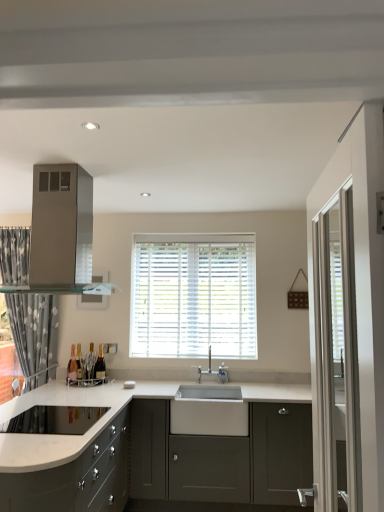
Describe the element at coordinates (209, 408) in the screenshot. I see `white matte sink at center` at that location.

Where is `matte gray cabinets at lower left, which is the 1th cabinetry in left-to-right order`? The height and width of the screenshot is (512, 384). matte gray cabinets at lower left, which is the 1th cabinetry in left-to-right order is located at coordinates (77, 478).

Measure the distance between point (236, 350) and camera.

They are 3.80 meters apart.

The image size is (384, 512). In order to click on satin silver range hood at upper left in this screenshot , I will do `click(61, 225)`.

Is shiny dark glass wine bottle at lower left, marked as the first wine bottle in a right-to-left arrangement, positioned far away from satin silver range hood at upper left?

Yes, shiny dark glass wine bottle at lower left, marked as the first wine bottle in a right-to-left arrangement, is far from satin silver range hood at upper left.

What are the coordinates of `appliance that appears on the left of shiny dark glass wine bottle at lower left, marked as the first wine bottle in a right-to-left arrangement` in the screenshot? It's located at (61, 225).

Is shiny dark glass wine bottle at lower left, marked as the first wine bottle in a right-to-left arrangement, positioned before satin silver range hood at upper left?

No, shiny dark glass wine bottle at lower left, marked as the first wine bottle in a right-to-left arrangement, is behind satin silver range hood at upper left.

What's the angular difference between shiny dark glass wine bottle at lower left, arranged as the second wine bottle when viewed from the left, and satin silver range hood at upper left's facing directions?

The angular difference between shiny dark glass wine bottle at lower left, arranged as the second wine bottle when viewed from the left, and satin silver range hood at upper left is 89.6 degrees.

Between white matte sink at center and matte gray cabinet at center, arranged as the second cabinetry when viewed from the left, which one has smaller size?

Smaller between the two is white matte sink at center.

Is white matte sink at center completely or partially outside of matte gray cabinet at center, arranged as the second cabinetry when viewed from the left?

No, white matte sink at center is inside matte gray cabinet at center, arranged as the second cabinetry when viewed from the left,'s boundary.

Which of these two, white matte sink at center or matte gray cabinet at center, positioned as the 1th cabinetry in right-to-left order, stands shorter?

white matte sink at center.

Considering the sizes of objects white matte sink at center and matte gray cabinet at center, arranged as the second cabinetry when viewed from the left, in the image provided, who is thinner, white matte sink at center or matte gray cabinet at center, arranged as the second cabinetry when viewed from the left,?

With smaller width is white matte sink at center.

Who is more distant, silver metallic faucet at center or white matte sink at center?

silver metallic faucet at center is more distant.

Which object is positioned more to the left, silver metallic faucet at center or white matte sink at center?

white matte sink at center.

What's the angular difference between silver metallic faucet at center and white matte sink at center's facing directions?

There is a 7.64e-05-degree angle between the facing directions of silver metallic faucet at center and white matte sink at center.

From the picture: Which of these two, silver metallic faucet at center or white matte sink at center, is wider?

white matte sink at center is wider.

How many degrees apart are the facing directions of matte gray cabinet at center, positioned as the 1th cabinetry in right-to-left order, and shiny dark glass wine bottle at lower left, marked as the first wine bottle in a right-to-left arrangement?

The angular difference between matte gray cabinet at center, positioned as the 1th cabinetry in right-to-left order, and shiny dark glass wine bottle at lower left, marked as the first wine bottle in a right-to-left arrangement, is 1.08 degrees.

Considering the positions of objects matte gray cabinet at center, positioned as the 1th cabinetry in right-to-left order, and shiny dark glass wine bottle at lower left, marked as the first wine bottle in a right-to-left arrangement, in the image provided, who is more to the right, matte gray cabinet at center, positioned as the 1th cabinetry in right-to-left order, or shiny dark glass wine bottle at lower left, marked as the first wine bottle in a right-to-left arrangement,?

matte gray cabinet at center, positioned as the 1th cabinetry in right-to-left order, is more to the right.

Is matte gray cabinet at center, positioned as the 1th cabinetry in right-to-left order, taller or shorter than shiny dark glass wine bottle at lower left, marked as the first wine bottle in a right-to-left arrangement?

In the image, matte gray cabinet at center, positioned as the 1th cabinetry in right-to-left order, appears to be taller than shiny dark glass wine bottle at lower left, marked as the first wine bottle in a right-to-left arrangement.

From the image's perspective, starting from the matte gray cabinet at center, positioned as the 1th cabinetry in right-to-left order, which wine bottle is the 1st one above? Please provide its 2D coordinates.

[(100, 365)]

I want to click on cabinetry that is the 1st one when counting downward from the satin silver range hood at upper left (from the image's perspective), so coord(77,478).

Consider the image. In terms of width, does matte gray cabinets at lower left, which is the 1th cabinetry in left-to-right order, look wider or thinner when compared to satin silver range hood at upper left?

Considering their sizes, matte gray cabinets at lower left, which is the 1th cabinetry in left-to-right order, looks broader than satin silver range hood at upper left.

Considering the sizes of objects matte gray cabinets at lower left, which is the 1th cabinetry in left-to-right order, and satin silver range hood at upper left in the image provided, who is shorter, matte gray cabinets at lower left, which is the 1th cabinetry in left-to-right order, or satin silver range hood at upper left?

satin silver range hood at upper left is shorter.

In the scene shown: Is matte gray cabinets at lower left, which is the 1th cabinetry in left-to-right order, positioned in front of satin silver range hood at upper left?

Yes, the depth of matte gray cabinets at lower left, which is the 1th cabinetry in left-to-right order, is less than that of satin silver range hood at upper left.

In the scene shown: Is silver metallic faucet at center positioned far away from shiny dark glass wine bottle at lower left, arranged as the second wine bottle when viewed from the left?

No, there isn't a large distance between silver metallic faucet at center and shiny dark glass wine bottle at lower left, arranged as the second wine bottle when viewed from the left.

Considering the sizes of silver metallic faucet at center and shiny dark glass wine bottle at lower left, marked as the first wine bottle in a right-to-left arrangement, in the image, is silver metallic faucet at center bigger or smaller than shiny dark glass wine bottle at lower left, marked as the first wine bottle in a right-to-left arrangement,?

Clearly, silver metallic faucet at center is larger in size than shiny dark glass wine bottle at lower left, marked as the first wine bottle in a right-to-left arrangement.

Considering the relative sizes of silver metallic faucet at center and shiny dark glass wine bottle at lower left, arranged as the second wine bottle when viewed from the left, in the image provided, is silver metallic faucet at center shorter than shiny dark glass wine bottle at lower left, arranged as the second wine bottle when viewed from the left,?

In fact, silver metallic faucet at center may be taller than shiny dark glass wine bottle at lower left, arranged as the second wine bottle when viewed from the left.

From the image's perspective, which object appears higher, silver metallic faucet at center or shiny dark glass wine bottle at lower left, marked as the first wine bottle in a right-to-left arrangement?

silver metallic faucet at center, from the image's perspective.

Which of these two, white wood blinds at center or satin silver range hood at upper left, stands taller?

With more height is white wood blinds at center.

Is white wood blinds at center touching satin silver range hood at upper left?

No, white wood blinds at center is not making contact with satin silver range hood at upper left.

Is satin silver range hood at upper left surrounded by white wood blinds at center?

No, satin silver range hood at upper left is located outside of white wood blinds at center.

Is white wood blinds at center smaller than satin silver range hood at upper left?

Yes, white wood blinds at center is smaller than satin silver range hood at upper left.

Identify the location of appliance that appears on the left of shiny dark glass wine bottle at lower left, arranged as the second wine bottle when viewed from the left. (61, 225).

There is a matte gray cabinet at center, arranged as the second cabinetry when viewed from the left. What are the coordinates of `sink above it (from a real-world perspective)` in the screenshot? It's located at (209, 408).

Considering their positions, is satin silver range hood at upper left positioned further to matte glass wine bottle at left, which appears as the 2th wine bottle when viewed from the right, than white matte sink at center?

satin silver range hood at upper left.

Estimate the real-world distances between objects in this image. Which object is closer to white matte sink at center, shiny dark glass wine bottle at lower left, arranged as the second wine bottle when viewed from the left, or silver metallic faucet at center?

The object closer to white matte sink at center is silver metallic faucet at center.

Which object lies further to the anchor point white matte sink at center, matte gray cabinet at center, positioned as the 1th cabinetry in right-to-left order, or shiny dark glass wine bottle at lower left, marked as the first wine bottle in a right-to-left arrangement?

Based on the image, shiny dark glass wine bottle at lower left, marked as the first wine bottle in a right-to-left arrangement, appears to be further to white matte sink at center.

Based on their spatial positions, is matte gray cabinets at lower left, the 2th cabinetry positioned from the right, or satin silver range hood at upper left closer to silver metallic faucet at center?

matte gray cabinets at lower left, the 2th cabinetry positioned from the right, is closer to silver metallic faucet at center.

In the scene shown: When comparing their distances from matte glass wine bottle at left, the 1th wine bottle from the left, does white matte sink at center or matte gray cabinet at center, arranged as the second cabinetry when viewed from the left, seem closer?

Based on the image, white matte sink at center appears to be nearer to matte glass wine bottle at left, the 1th wine bottle from the left.

Which object lies further to the anchor point white matte sink at center, matte glass wine bottle at left, which appears as the 2th wine bottle when viewed from the right, or matte gray cabinets at lower left, which is the 1th cabinetry in left-to-right order?

Based on the image, matte glass wine bottle at left, which appears as the 2th wine bottle when viewed from the right, appears to be further to white matte sink at center.

Estimate the real-world distances between objects in this image. Which object is closer to satin silver range hood at upper left, matte glass wine bottle at left, which appears as the 2th wine bottle when viewed from the right, or silver metallic faucet at center?

The object closer to satin silver range hood at upper left is matte glass wine bottle at left, which appears as the 2th wine bottle when viewed from the right.

When comparing their distances from satin silver range hood at upper left, does white wood blinds at center or matte gray cabinets at lower left, the 2th cabinetry positioned from the right, seem further?

white wood blinds at center is further to satin silver range hood at upper left.

Find the location of a particular element. window between matte glass wine bottle at left, which appears as the 2th wine bottle when viewed from the right, and white matte sink at center, in the horizontal direction is located at coordinates (193, 296).

Image resolution: width=384 pixels, height=512 pixels. In order to click on cabinetry between matte gray cabinets at lower left, which is the 1th cabinetry in left-to-right order, and white matte sink at center from front to back in this screenshot , I will do `click(222, 457)`.

Locate an element on the screen. The image size is (384, 512). tap that lies between satin silver range hood at upper left and white matte sink at center from top to bottom is located at coordinates (213, 372).

You are a GUI agent. You are given a task and a screenshot of the screen. Output one action in this format:
    pyautogui.click(x=<x>, y=<y>)
    Task: Click on the tap between matte gray cabinets at lower left, which is the 1th cabinetry in left-to-right order, and shiny dark glass wine bottle at lower left, marked as the first wine bottle in a right-to-left arrangement, from front to back
    
    Given the screenshot: What is the action you would take?
    pyautogui.click(x=213, y=372)